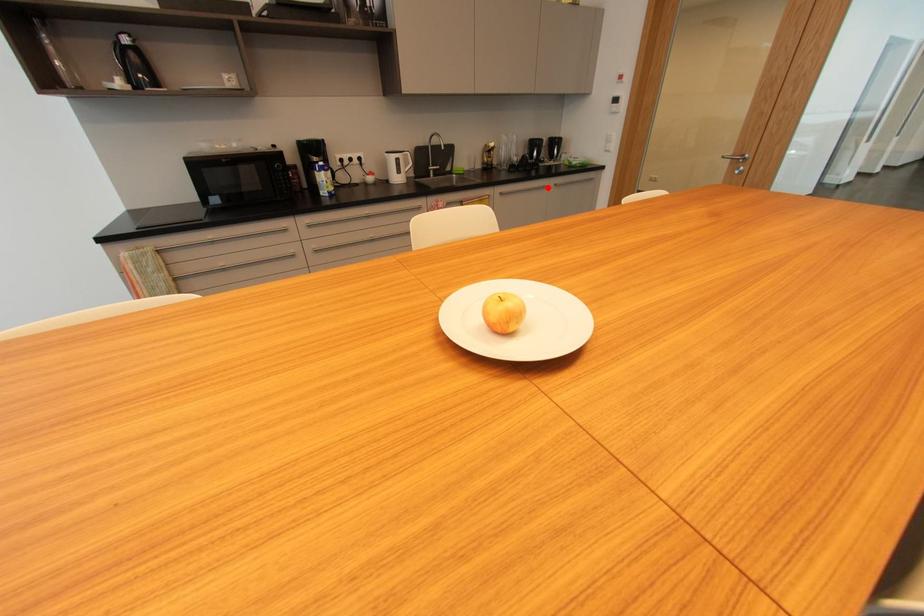
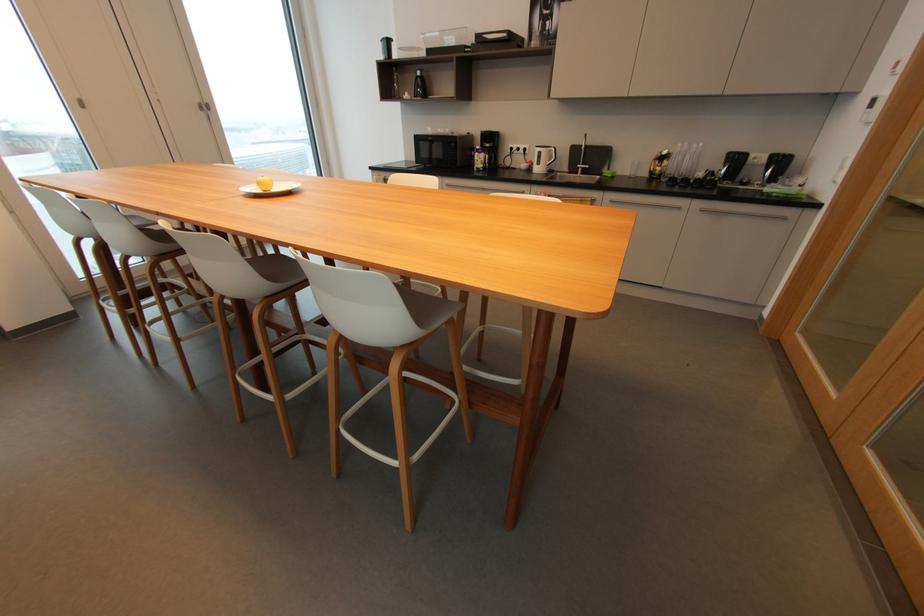
Find the pixel in the second image that matches the highlighted location in the first image.

(683, 208)